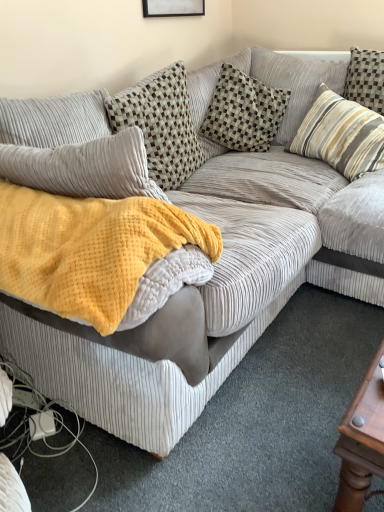
Question: Does point tap(362, 131) appear closer or farther from the camera than point tap(1, 217)?

Choices:
 (A) farther
 (B) closer

Answer: (A)

Question: Which is correct: striped fabric pillow at upper right, the third pillow in the left-to-right sequence, is inside yellow waffle knit blanket at center, or outside of it?

Choices:
 (A) inside
 (B) outside

Answer: (B)

Question: Estimate the real-world distances between objects in this image. Which object is farther from the striped fabric pillow at upper right, the third pillow in the left-to-right sequence?

Choices:
 (A) yellow waffle knit blanket at center
 (B) checkered fabric pillow at center, placed as the 2th pillow when sorted from left to right
 (C) checkered fabric pillow at upper left, marked as the first pillow in a left-to-right arrangement

Answer: (A)

Question: Estimate the real-world distances between objects in this image. Which object is closer to the checkered fabric pillow at center, the second pillow in the right-to-left sequence?

Choices:
 (A) yellow waffle knit blanket at center
 (B) striped fabric pillow at upper right, which is counted as the 1th pillow, starting from the right
 (C) checkered fabric pillow at upper left, marked as the first pillow in a left-to-right arrangement

Answer: (B)